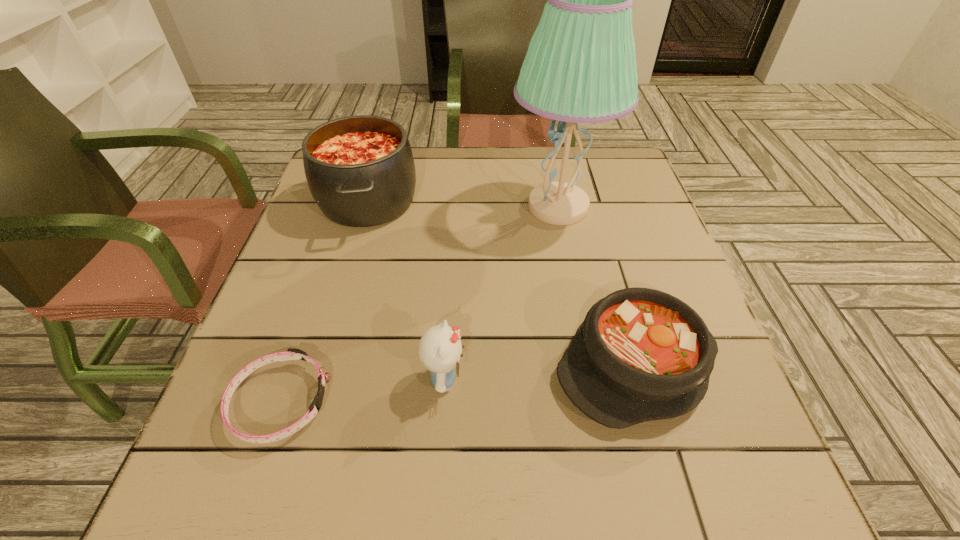
Identify the location of lamp. Image resolution: width=960 pixels, height=540 pixels. (580, 67).

You are a GUI agent. You are given a task and a screenshot of the screen. Output one action in this format:
    pyautogui.click(x=<x>, y=<y>)
    Task: Click on the taller casserole
    
    Given the screenshot: What is the action you would take?
    pyautogui.click(x=360, y=170)

Where is `the left casserole`? The height and width of the screenshot is (540, 960). the left casserole is located at coordinates (360, 170).

You are a GUI agent. You are given a task and a screenshot of the screen. Output one action in this format:
    pyautogui.click(x=<x>, y=<y>)
    Task: Click on the third object from left to right
    This screenshot has width=960, height=540.
    Given the screenshot: What is the action you would take?
    pyautogui.click(x=440, y=349)

The width and height of the screenshot is (960, 540). Find the location of `the third tallest object`. the third tallest object is located at coordinates (440, 349).

Where is `the nearer casserole`? This screenshot has height=540, width=960. the nearer casserole is located at coordinates (641, 354).

Where is `the second shortest object`? The image size is (960, 540). the second shortest object is located at coordinates (641, 354).

Identify the location of dog collar. Image resolution: width=960 pixels, height=540 pixels. (291, 354).

The height and width of the screenshot is (540, 960). What are the coordinates of `free spot located 0.110m on the back of the lamp` in the screenshot? It's located at (548, 157).

This screenshot has width=960, height=540. Identify the location of free space located 0.200m on the right of the fourth shortest object. (496, 201).